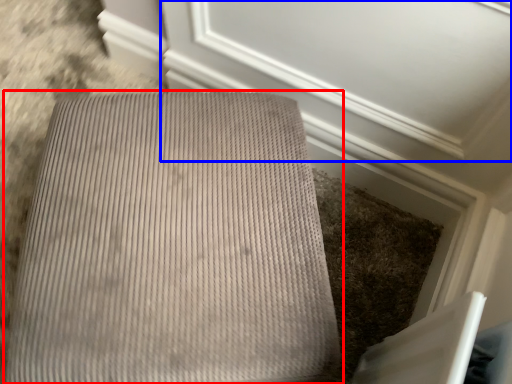
Question: Among these objects, which one is farthest to the camera, furniture (highlighted by a red box) or screen door (highlighted by a blue box)?

Choices:
 (A) furniture
 (B) screen door

Answer: (B)